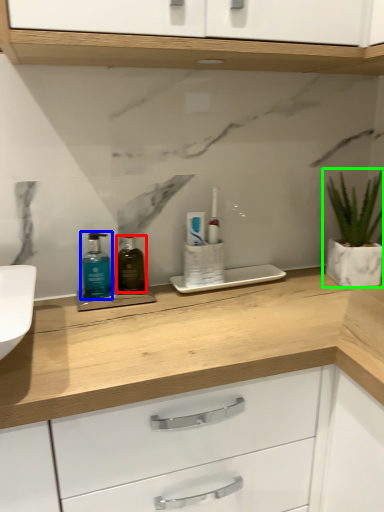
Question: Which is farther away from mouthwash (highlighted by a red box)? mouthwash (highlighted by a blue box) or houseplant (highlighted by a green box)?

Choices:
 (A) mouthwash
 (B) houseplant

Answer: (B)